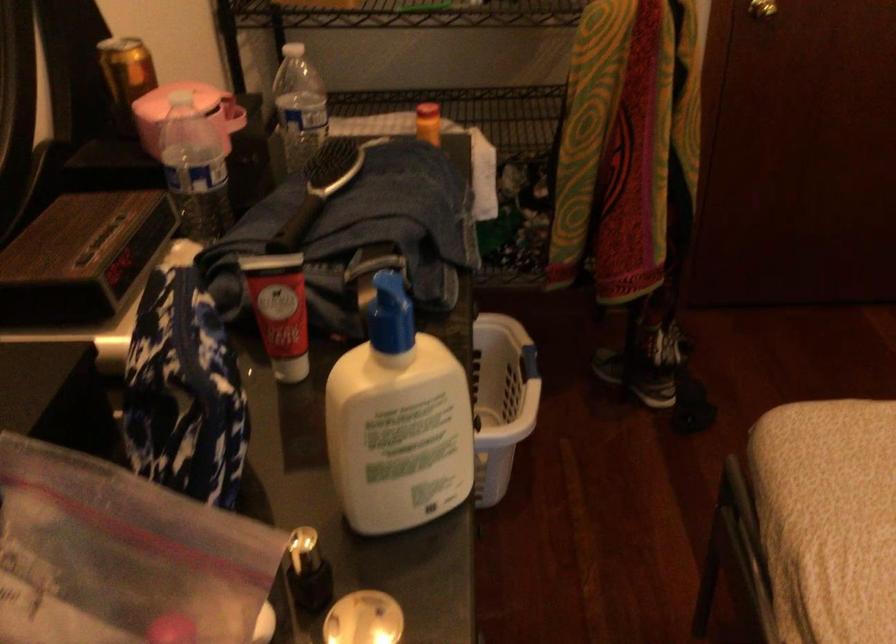
Locate an element on the screen. The image size is (896, 644). laundry basket handle is located at coordinates (529, 363).